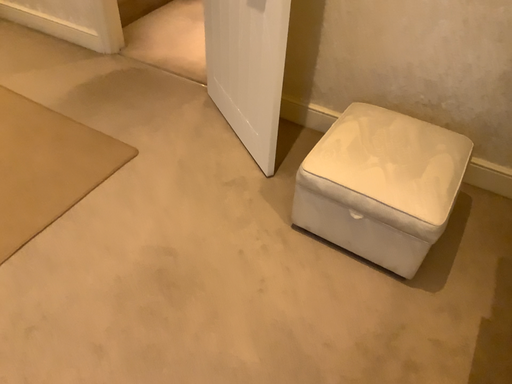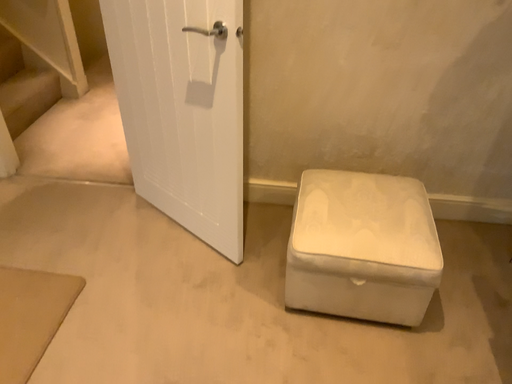
Question: Which way did the camera rotate in the video?

Choices:
 (A) rotated right
 (B) rotated left

Answer: (A)